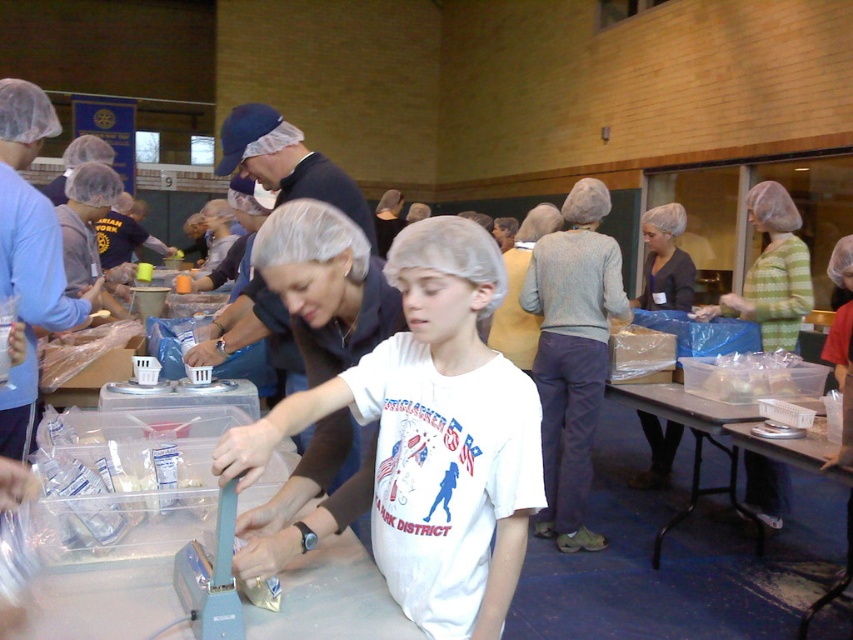
Is green striped shirt at center thinner than translucent plastic container at lower right?

In fact, green striped shirt at center might be wider than translucent plastic container at lower right.

Can you confirm if green striped shirt at center is taller than translucent plastic container at lower right?

Yes, green striped shirt at center is taller than translucent plastic container at lower right.

Is point (767, 460) positioned behind point (757, 387)?

Yes, point (767, 460) is farther from viewer.

At what (x,y) coordinates should I click in order to perform the action: click on green striped shirt at center. Please return your answer as a coordinate pair (x, y). This screenshot has width=853, height=640. Looking at the image, I should click on (770, 273).

Locate an element on the screen. green striped shirt at center is located at coordinates (770, 273).

Can you confirm if green striped shirt at center is wider than matte black shirt at center?

Correct, the width of green striped shirt at center exceeds that of matte black shirt at center.

Describe the element at coordinates (770, 273) in the screenshot. This screenshot has width=853, height=640. I see `green striped shirt at center` at that location.

This screenshot has width=853, height=640. I want to click on green striped shirt at center, so click(x=770, y=273).

Between white cotton shirt at center and matte black shirt at center, which one has less height?

With less height is matte black shirt at center.

Is white cotton shirt at center to the right of matte black shirt at center from the viewer's perspective?

Incorrect, white cotton shirt at center is not on the right side of matte black shirt at center.

Which is in front, point (409, 403) or point (651, 243)?

Point (409, 403) is in front.

The height and width of the screenshot is (640, 853). I want to click on white cotton shirt at center, so click(433, 436).